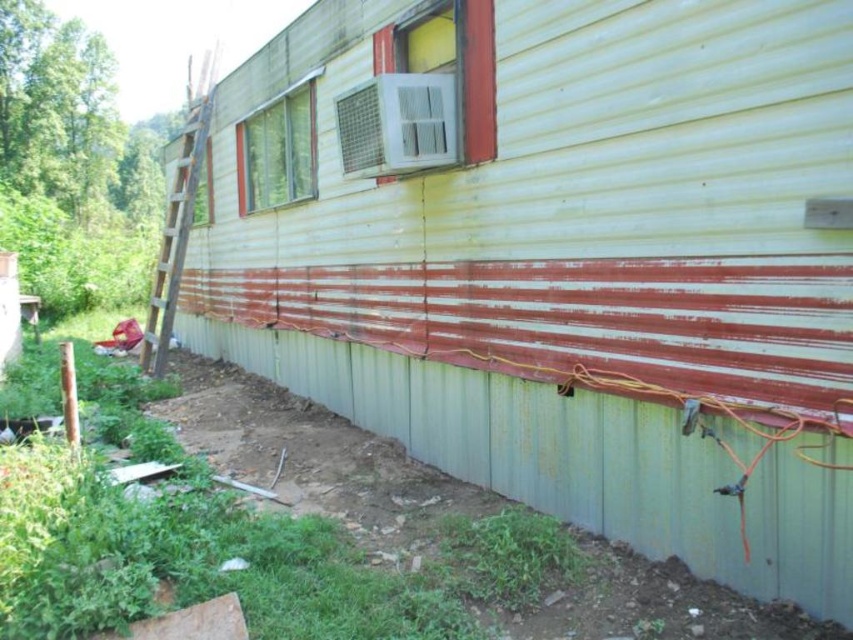
Question: Can you confirm if wooden at left is positioned below clear glass window at upper center?

Choices:
 (A) yes
 (B) no

Answer: (B)

Question: Which of the following is the closest to the observer?

Choices:
 (A) clear glass window at upper center
 (B) wooden at left

Answer: (A)

Question: Can you confirm if wooden at left is thinner than clear glass window at upper center?

Choices:
 (A) no
 (B) yes

Answer: (A)

Question: Can you confirm if wooden at left is smaller than clear glass window at upper center?

Choices:
 (A) yes
 (B) no

Answer: (B)